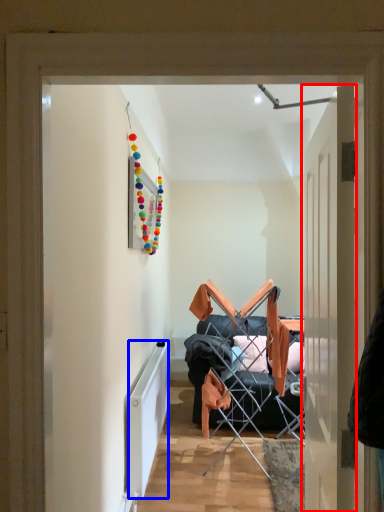
Question: Which object is closer to the camera taking this photo, door (highlighted by a red box) or radiator (highlighted by a blue box)?

Choices:
 (A) door
 (B) radiator

Answer: (A)